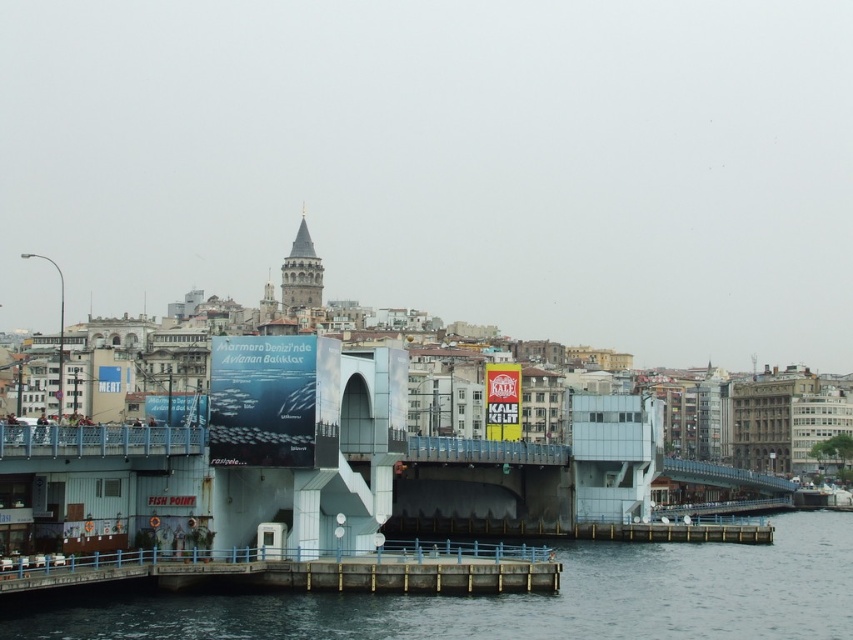
Is smooth concrete pier at lower center above smooth concrete dock at lower center?

No.

Measure the distance between smooth concrete pier at lower center and smooth concrete dock at lower center.

smooth concrete pier at lower center is 25.21 feet from smooth concrete dock at lower center.

Is point (16, 634) farther from viewer compared to point (189, 579)?

No, (16, 634) is in front of (189, 579).

Where is `smooth concrete pier at lower center`? smooth concrete pier at lower center is located at coordinates (529, 600).